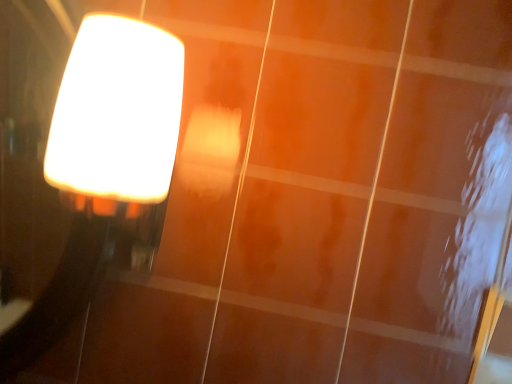
This screenshot has height=384, width=512. What do you see at coordinates (103, 166) in the screenshot? I see `matte white lampshade at upper left` at bounding box center [103, 166].

This screenshot has width=512, height=384. Find the location of `matte white lampshade at upper left`. matte white lampshade at upper left is located at coordinates (103, 166).

I want to click on matte white lampshade at upper left, so click(x=103, y=166).